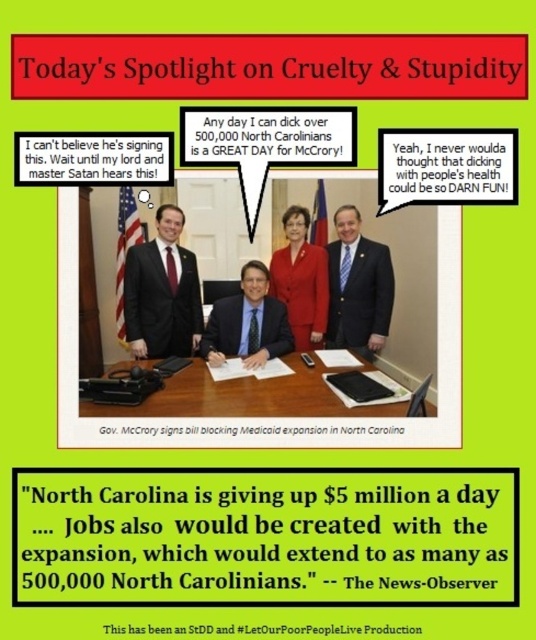
You are a fashion critic attending a virtual event where you see the image. You need to decide which suit is more prominent based on their positions. Which suit, the matte black suit at center or the blue suit at center, is placed higher up in the image?

The blue suit at center is placed higher up in the image because the matte black suit at center is positioned under it.

You are a photographer adjusting the focus on your camera. You notice two points in the image labeled as point 1 at coordinates (390,268) and point 2 at coordinates (278,301). Which point should you focus on first if you want to ensure the closer object is sharp?

Point 2 at coordinates (278,301) should be focused on first because it is closer to the camera than point 1 at coordinates (390,268), ensuring the closer object remains sharp.

You are a fashion critic attending a virtual event where you see two suits displayed side by side in the spotlight. The suits are the matte black suit at center and the matte red suit at center. Based on their height in the image, which suit appears to be larger?

The matte black suit at center appears larger because it is taller than the matte red suit at center.